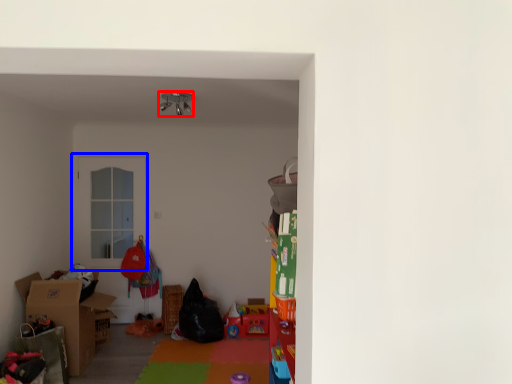
Question: Which object is further to the camera taking this photo, lamp (highlighted by a red box) or door (highlighted by a blue box)?

Choices:
 (A) lamp
 (B) door

Answer: (B)